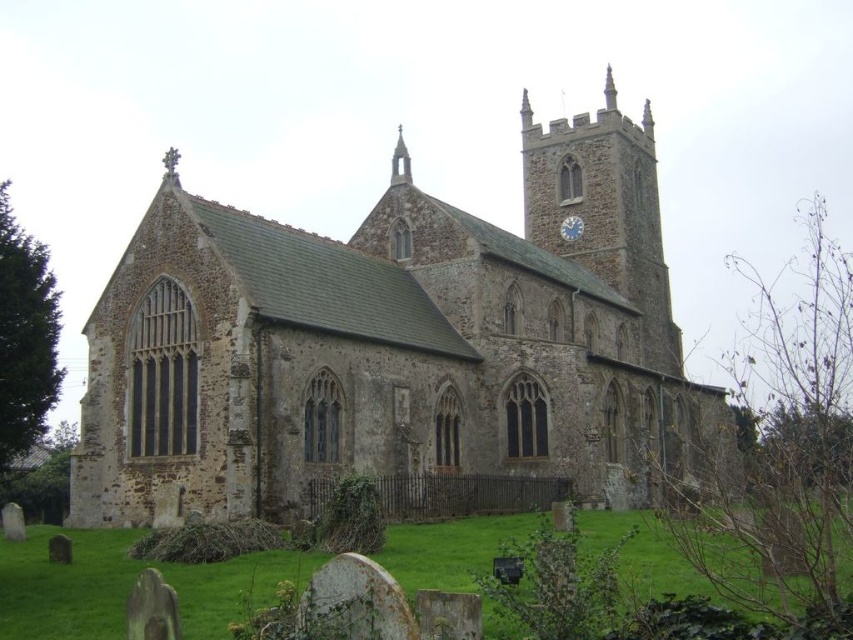
Question: Does brown stone church at center have a lesser width compared to stone clock tower at upper right?

Choices:
 (A) no
 (B) yes

Answer: (A)

Question: Which point is farther to the camera?

Choices:
 (A) (254, 458)
 (B) (576, 225)
 (C) (535, 161)

Answer: (C)

Question: Based on their relative distances, which object is farther from the white metallic clock at upper right?

Choices:
 (A) stone clock tower at upper right
 (B) brown stone church at center

Answer: (B)

Question: Which point appears farthest from the camera in this image?

Choices:
 (A) (646, 134)
 (B) (636, 317)

Answer: (A)

Question: Does brown stone church at center lie in front of stone clock tower at upper right?

Choices:
 (A) no
 (B) yes

Answer: (B)

Question: In this image, where is brown stone church at center located relative to white metallic clock at upper right?

Choices:
 (A) below
 (B) above

Answer: (A)